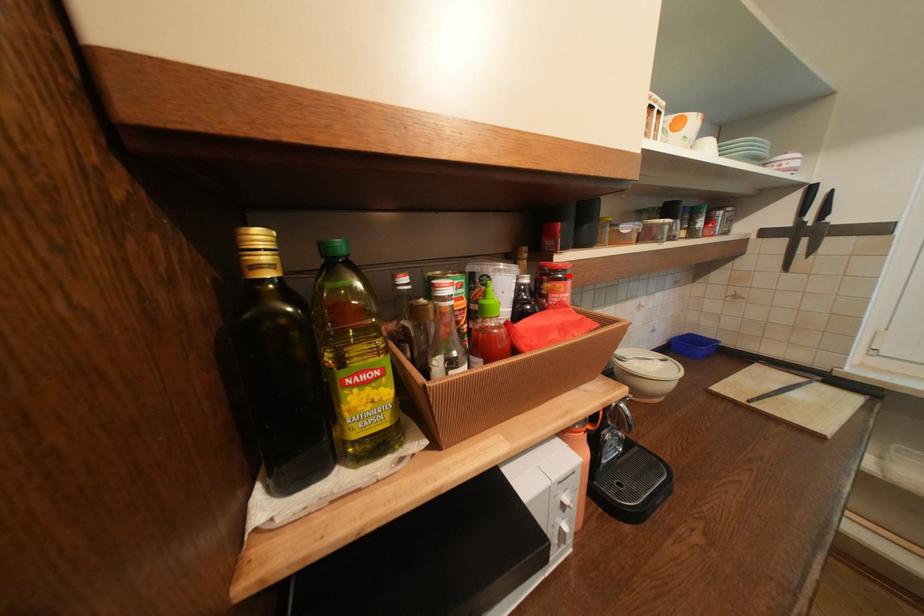
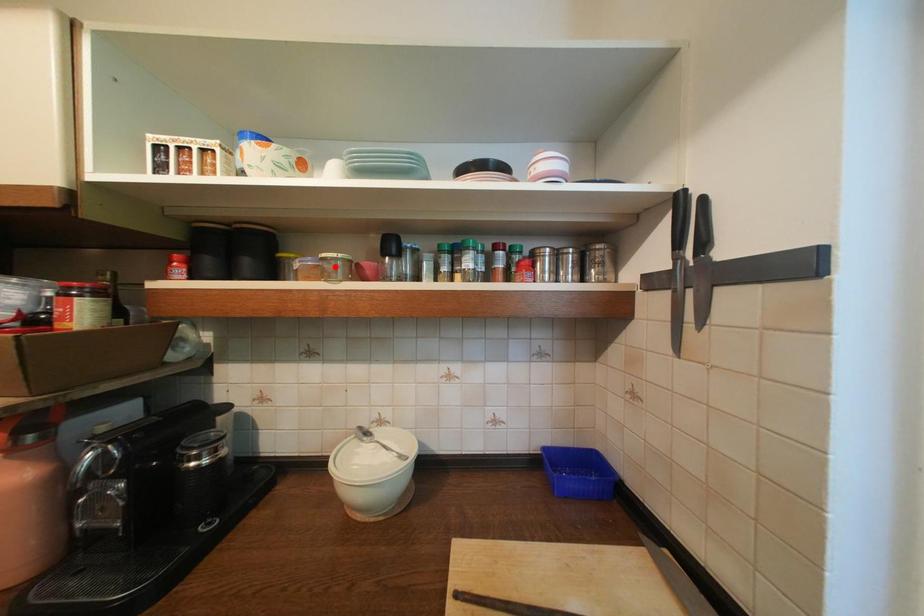
I am providing you with two images of the same scene from different viewpoints. A red point is marked on the first image and another point is marked on the second image. Is the marked point in image1 the same physical position as the marked point in image2?

No